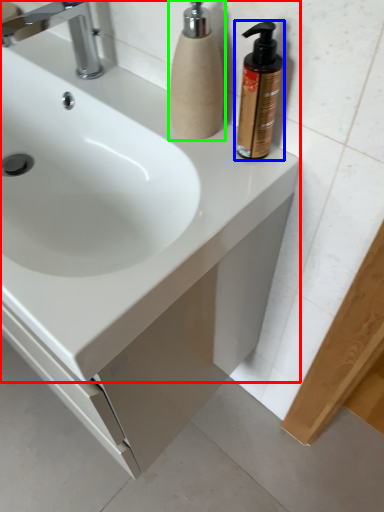
Question: Considering the real-world distances, which object is farthest from sink (highlighted by a red box)? soap dispenser (highlighted by a blue box) or soap dispenser (highlighted by a green box)?

Choices:
 (A) soap dispenser
 (B) soap dispenser

Answer: (A)